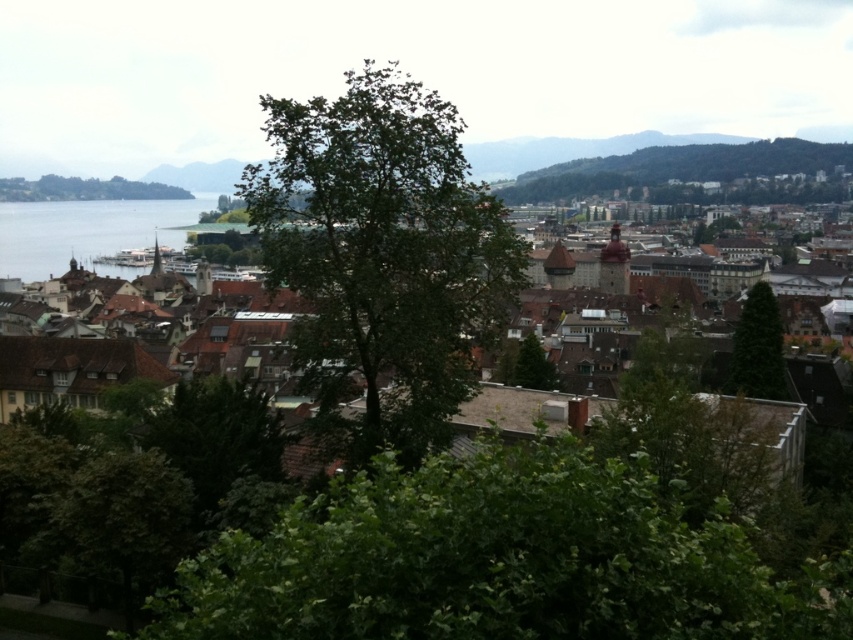
You are standing at the point labeled point (488,266) and want to walk to the point labeled point (108,248). Which direction should you move to get closer to your destination?

You should move away from the camera because point (488,266) is closer to the camera than point (108,248). Moving away from the camera would bring you closer to the destination.

You are an urban planner reviewing this cityscape. You notice two green leafy trees in the foreground. Which tree, the green leafy tree at center or the green leafy tree at left, is closer to the viewer?

The green leafy tree at center is closer to the viewer because it is positioned under the green leafy tree at left, indicating it is in front.

You are an urban planner reviewing this cityscape. You need to determine if the green leafy tree at center can be removed to widen the road without affecting the structural integrity of the brown tiled roofs at center. Based on the spatial relationship between them, is this feasible?

The green leafy tree at center is thinner than brown tiled roofs at center, so removing the tree would not compromise the structural integrity of the brown tiled roofs at center since the tree is narrower and likely does not provide support to the roofs.